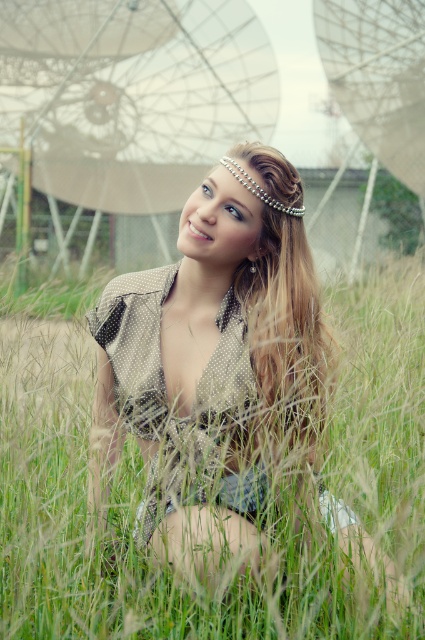
Can you confirm if matte beige dress at center is smaller than pearl/textured hair accessory at upper center?

No, matte beige dress at center is not smaller than pearl/textured hair accessory at upper center.

Is matte beige dress at center further to camera compared to pearl/textured hair accessory at upper center?

No, matte beige dress at center is in front of pearl/textured hair accessory at upper center.

Is point (113, 333) less distant than point (238, 177)?

That is False.

Identify the location of matte beige dress at center. The width and height of the screenshot is (425, 640). (212, 376).

The height and width of the screenshot is (640, 425). What do you see at coordinates (282, 301) in the screenshot?
I see `blonde textured hair at center` at bounding box center [282, 301].

Does blonde textured hair at center have a greater height compared to pearl/textured hair accessory at upper center?

Yes, blonde textured hair at center is taller than pearl/textured hair accessory at upper center.

Describe the element at coordinates (282, 301) in the screenshot. I see `blonde textured hair at center` at that location.

The image size is (425, 640). I want to click on blonde textured hair at center, so [282, 301].

Is matte beige dress at center to the right of blonde textured hair at center from the viewer's perspective?

Incorrect, matte beige dress at center is not on the right side of blonde textured hair at center.

Is point (122, 433) positioned behind point (260, 404)?

Yes, point (122, 433) is farther from viewer.

Between point (166, 416) and point (266, 305), which one is positioned behind?

The point (266, 305) is more distant.

Locate an element on the screen. Image resolution: width=425 pixels, height=640 pixels. matte beige dress at center is located at coordinates (212, 376).